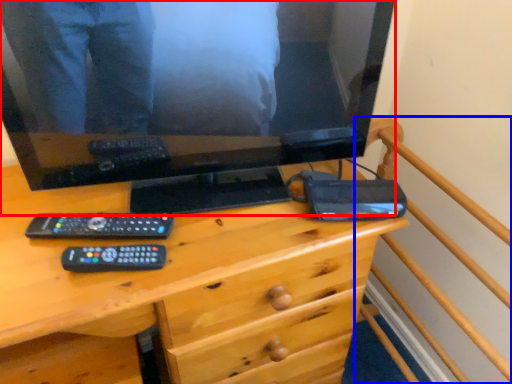
Question: Which object is further to the camera taking this photo, television (highlighted by a red box) or bed frame (highlighted by a blue box)?

Choices:
 (A) television
 (B) bed frame

Answer: (A)